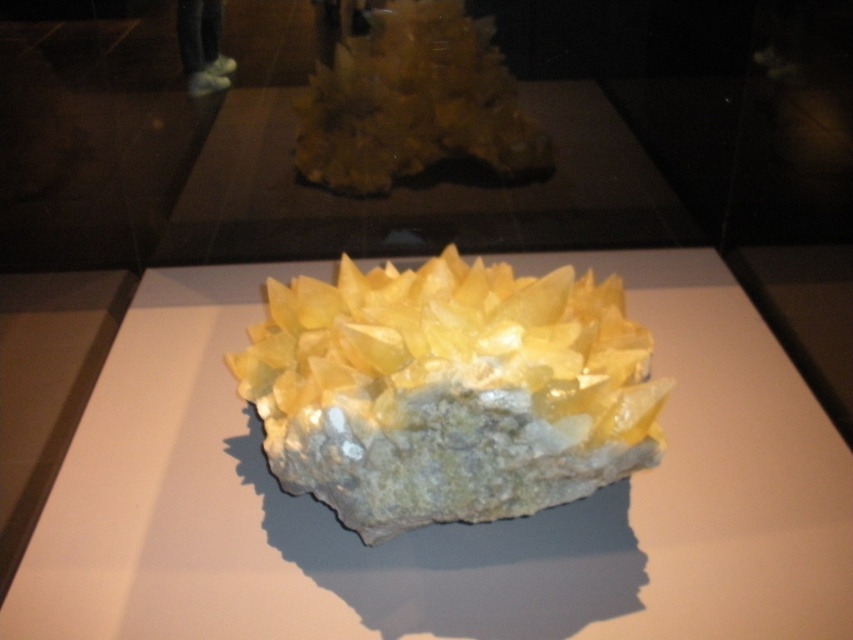
Who is taller, translucent yellow crystal at center or yellow crystal at center?

Standing taller between the two is translucent yellow crystal at center.

The height and width of the screenshot is (640, 853). Describe the element at coordinates (445, 525) in the screenshot. I see `translucent yellow crystal at center` at that location.

Describe the element at coordinates (445, 525) in the screenshot. I see `translucent yellow crystal at center` at that location.

The image size is (853, 640). What are the coordinates of `translucent yellow crystal at center` in the screenshot? It's located at (445, 525).